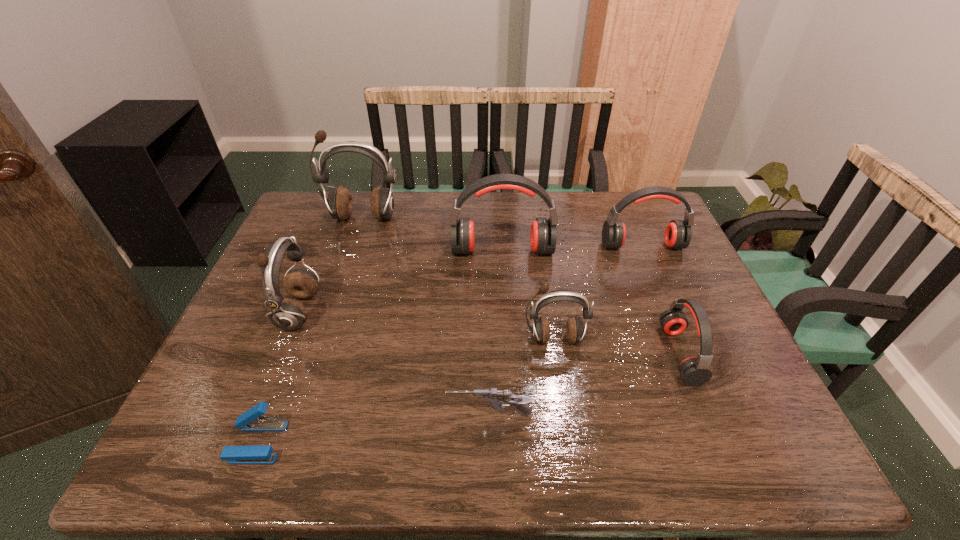
Find the location of a particular element. Image resolution: width=960 pixels, height=540 pixels. blank region between the blue stapler and the sixth tallest object is located at coordinates (468, 398).

Image resolution: width=960 pixels, height=540 pixels. I want to click on unoccupied position between the second smallest brown earphone and the biggest red earphone, so click(400, 281).

You are a GUI agent. You are given a task and a screenshot of the screen. Output one action in this format:
    pyautogui.click(x=<x>, y=<y>)
    Task: Click on the vacant point located between the biggest red earphone and the second biggest brown earphone
    This screenshot has width=960, height=540.
    Given the screenshot: What is the action you would take?
    pyautogui.click(x=400, y=281)

Choose which object is the nearest neighbor to the biggest red earphone. Please provide its 2D coordinates. Your answer should be formatted as a tuple, i.e. [(x, y)], where the tuple contains the x and y coordinates of a point satisfying the conditions above.

[(678, 233)]

Identify which object is located as the sixth nearest to the smallest brown earphone. Please provide its 2D coordinates. Your answer should be formatted as a tuple, i.e. [(x, y)], where the tuple contains the x and y coordinates of a point satisfying the conditions above.

[(252, 420)]

Identify the location of earphone that is the fourth nearest to the second biggest red earphone. 340,204.

The width and height of the screenshot is (960, 540). Find the location of `the third closest earphone to the second biggest brown earphone`. the third closest earphone to the second biggest brown earphone is located at coordinates (540, 329).

Identify which brown earphone is the second closest to the biggest red earphone. Please provide its 2D coordinates. Your answer should be formatted as a tuple, i.e. [(x, y)], where the tuple contains the x and y coordinates of a point satisfying the conditions above.

[(540, 329)]

Where is `the second closest brown earphone to the shortest object`? The height and width of the screenshot is (540, 960). the second closest brown earphone to the shortest object is located at coordinates (540, 329).

I want to click on red earphone that is the third closest to the second biggest brown earphone, so click(x=695, y=371).